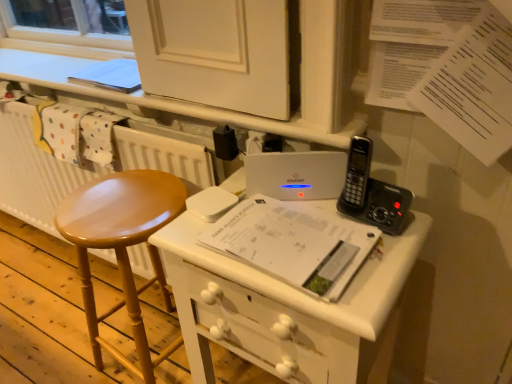
Question: Would you consider white matte radiator at left to be distant from shiny wood stool at left?

Choices:
 (A) no
 (B) yes

Answer: (A)

Question: Does white matte radiator at left have a greater width compared to shiny wood stool at left?

Choices:
 (A) yes
 (B) no

Answer: (B)

Question: Is white matte radiator at left positioned in front of shiny wood stool at left?

Choices:
 (A) no
 (B) yes

Answer: (A)

Question: From a real-world perspective, does white matte radiator at left stand above shiny wood stool at left?

Choices:
 (A) no
 (B) yes

Answer: (B)

Question: From a real-world perspective, is white matte radiator at left physically below shiny wood stool at left?

Choices:
 (A) no
 (B) yes

Answer: (A)

Question: Is white matte radiator at left further to the viewer compared to shiny wood stool at left?

Choices:
 (A) yes
 (B) no

Answer: (A)

Question: Is white paper at center located within shiny wood stool at left?

Choices:
 (A) yes
 (B) no

Answer: (B)

Question: Is shiny wood stool at left at the left side of white paper at center?

Choices:
 (A) yes
 (B) no

Answer: (A)

Question: Can you confirm if shiny wood stool at left is thinner than white paper at center?

Choices:
 (A) yes
 (B) no

Answer: (B)

Question: Does shiny wood stool at left have a greater width compared to white paper at center?

Choices:
 (A) no
 (B) yes

Answer: (B)

Question: From a real-world perspective, is shiny wood stool at left physically below white paper at center?

Choices:
 (A) yes
 (B) no

Answer: (A)

Question: Are shiny wood stool at left and white paper at center located far from each other?

Choices:
 (A) no
 (B) yes

Answer: (A)

Question: From the image's perspective, does white paper at center appear lower than white matte radiator at left?

Choices:
 (A) no
 (B) yes

Answer: (B)